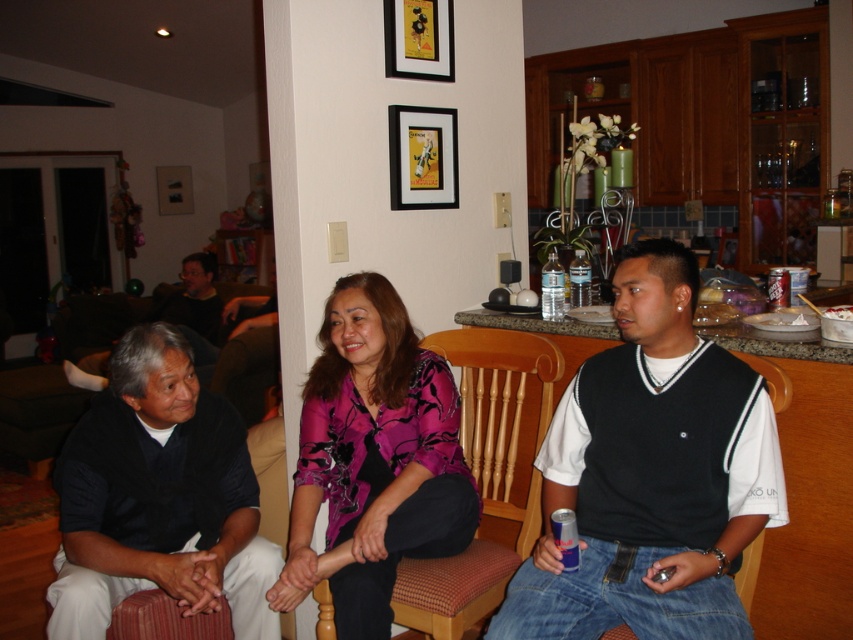
Does pink printed blouse at center have a smaller size compared to matte black picture frame at upper center?

Incorrect, pink printed blouse at center is not smaller in size than matte black picture frame at upper center.

Between pink printed blouse at center and matte black picture frame at upper center, which one appears on the right side from the viewer's perspective?

matte black picture frame at upper center is more to the right.

Which is behind, point (352, 548) or point (390, 128)?

The point (390, 128) is more distant.

Image resolution: width=853 pixels, height=640 pixels. In order to click on pink printed blouse at center in this screenshot , I will do `click(376, 456)`.

Can you confirm if black knit vest at center is smaller than pink printed blouse at center?

No, black knit vest at center is not smaller than pink printed blouse at center.

Can you confirm if black knit vest at center is shorter than pink printed blouse at center?

Yes.

Locate an element on the screen. black knit vest at center is located at coordinates point(651,474).

Locate an element on the screen. This screenshot has width=853, height=640. black knit vest at center is located at coordinates (651, 474).

Can you confirm if matte black picture frame at upper center is thinner than gold metallic picture frame at upper center?

No, matte black picture frame at upper center is not thinner than gold metallic picture frame at upper center.

Is matte black picture frame at upper center smaller than gold metallic picture frame at upper center?

Actually, matte black picture frame at upper center might be larger than gold metallic picture frame at upper center.

Which is behind, point (445, 184) or point (387, 64)?

The point (445, 184) is more distant.

Where is `matte black picture frame at upper center`? matte black picture frame at upper center is located at coordinates [x=422, y=157].